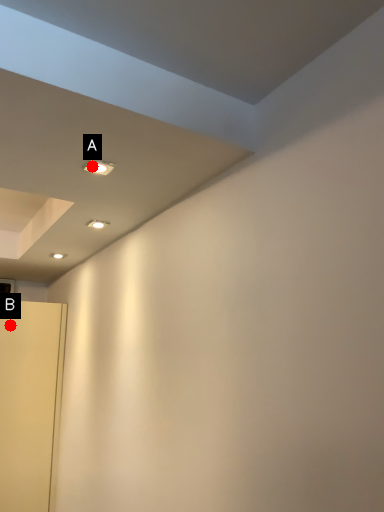
Question: Two points are circled on the image, labeled by A and B beside each circle. Which point appears closest to the camera in this image?

Choices:
 (A) A is closer
 (B) B is closer

Answer: (A)